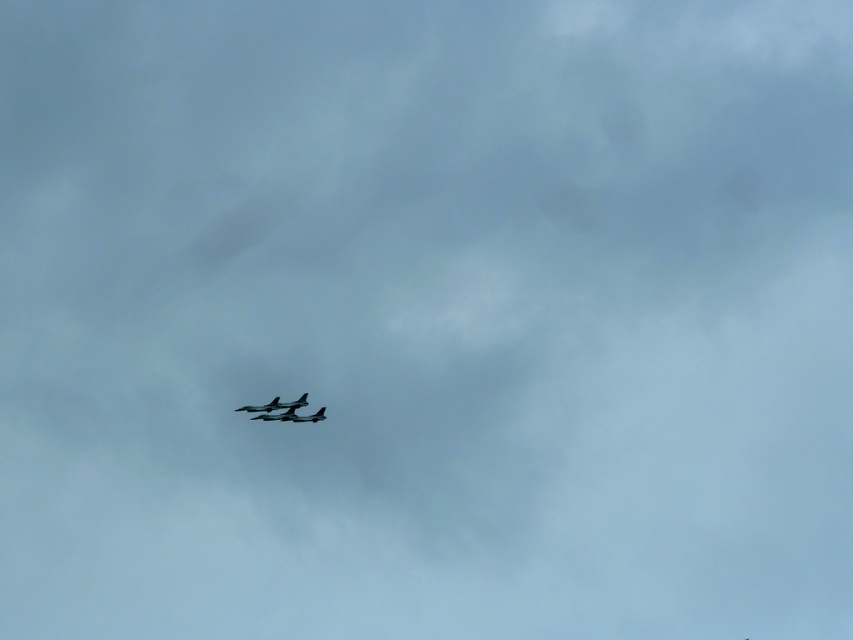
Measure the distance between point [286,412] and camera.

Point [286,412] and camera are 739.71 feet apart.

Image resolution: width=853 pixels, height=640 pixels. I want to click on shiny dark gray jet at center, so click(x=292, y=416).

This screenshot has width=853, height=640. What are the coordinates of `shiny dark gray jet at center` in the screenshot? It's located at (292, 416).